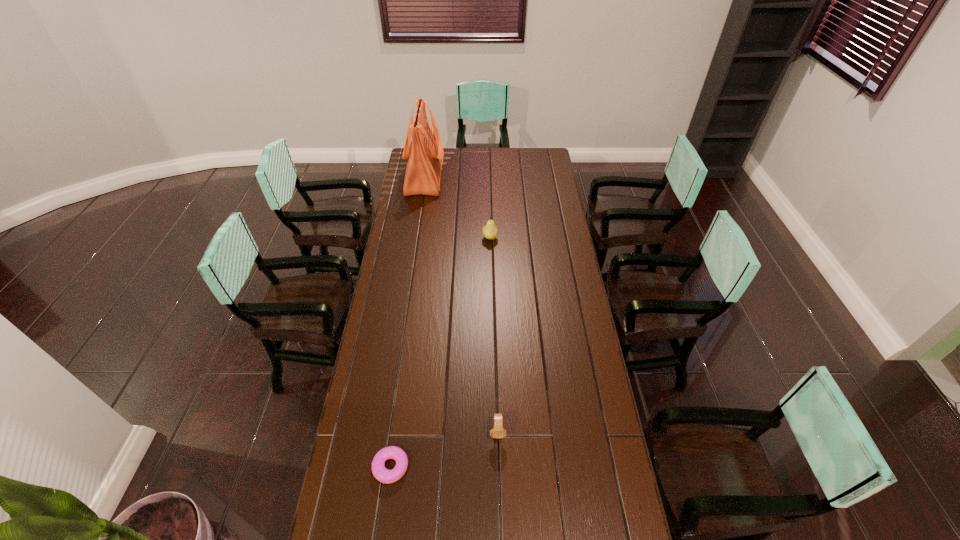
You are a GUI agent. You are given a task and a screenshot of the screen. Output one action in this format:
    pyautogui.click(x=<x>, y=<y>)
    Task: Click on the free spot between the tallest object and the nearest object
    The height and width of the screenshot is (540, 960).
    Given the screenshot: What is the action you would take?
    point(408,322)

Where is `vacant region between the second farthest object and the doughnut`? The image size is (960, 540). vacant region between the second farthest object and the doughnut is located at coordinates (441, 352).

Locate an element on the screen. free space between the shopping bag and the third shortest object is located at coordinates (457, 207).

The height and width of the screenshot is (540, 960). What are the coordinates of `free space between the second nearest object and the third nearest object` in the screenshot? It's located at (493, 335).

This screenshot has height=540, width=960. I want to click on free space between the shopping bag and the pear, so click(457, 207).

At what (x,y) coordinates should I click in order to perform the action: click on vacant area between the second nearest object and the third nearest object. Please return your answer as a coordinate pair (x, y). The width and height of the screenshot is (960, 540). Looking at the image, I should click on (493, 335).

Locate an element on the screen. This screenshot has width=960, height=540. free space between the second nearest object and the doughnut is located at coordinates (444, 449).

The height and width of the screenshot is (540, 960). Find the location of `vacant area between the farthest object and the watch`. vacant area between the farthest object and the watch is located at coordinates (461, 305).

Locate an element on the screen. The height and width of the screenshot is (540, 960). free space between the doughnut and the second farthest object is located at coordinates (441, 352).

Select which object appears as the third closest to the third tallest object. Please provide its 2D coordinates. Your answer should be formatted as a tuple, i.e. [(x, y)], where the tuple contains the x and y coordinates of a point satisfying the conditions above.

[(425, 153)]